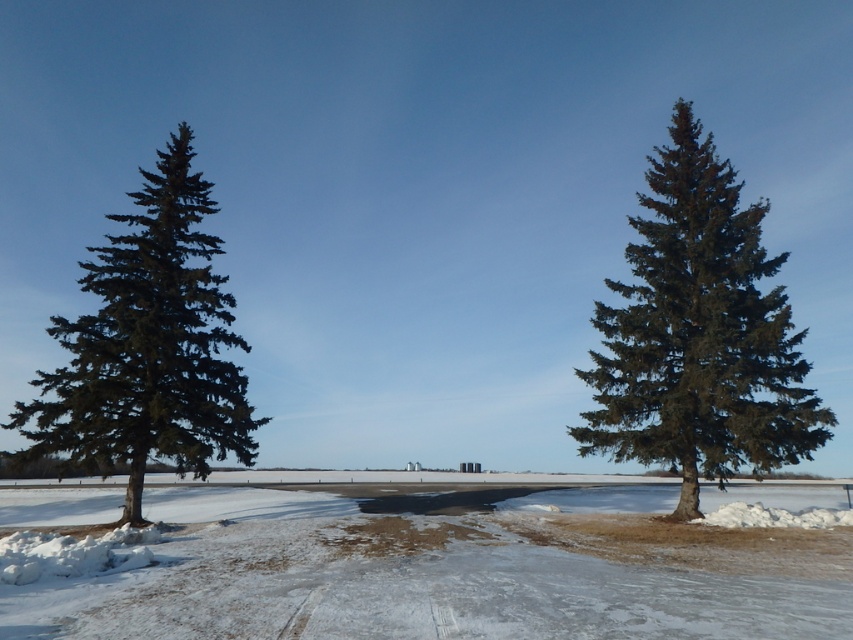
You are standing in the winter landscape and want to place a small snowman. You have two points marked on the ground where you can build it. The first point is at coordinates point (248, 572) and the second is at point (683, 289). Which point is closer to you where you can build the snowman?

Point (248, 572) is closer to the viewer than point (683, 289), so you can build the snowman there as it is nearer to your current position.

You are standing in the winter landscape and want to walk from the point closer to you to the farther point. Which path would you take between the two points, point (735, 269) and point (248, 461)?

The path from point (735, 269) to point (248, 461) would go from the closer point to the farther one, as point (735, 269) is nearer to the viewer than point (248, 461).